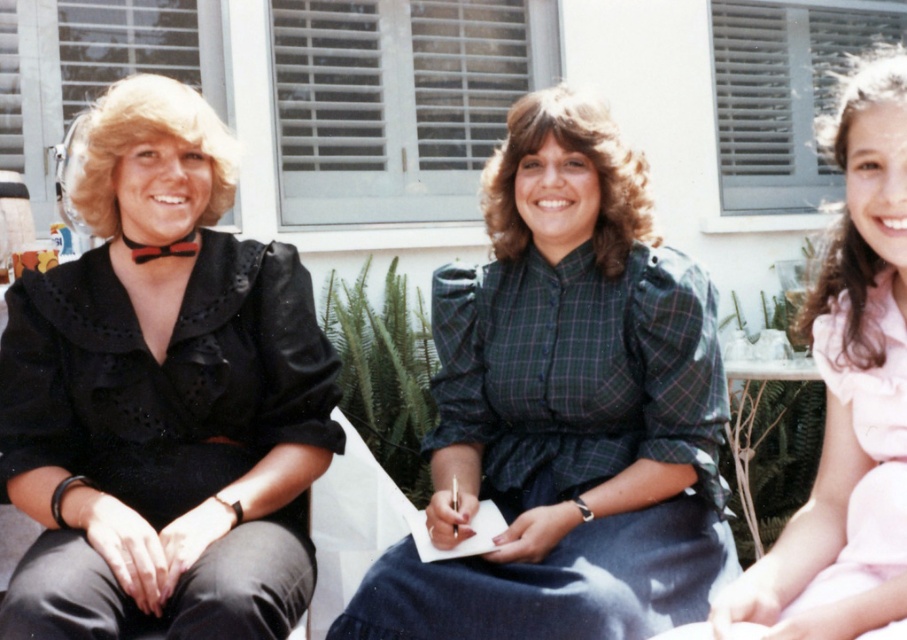
Is green plaid dress at center bigger than pink satin dress at right?

Correct, green plaid dress at center is larger in size than pink satin dress at right.

Between point (574, 310) and point (800, 328), which one is positioned in front?

Point (800, 328) is more forward.

The height and width of the screenshot is (640, 907). What are the coordinates of `green plaid dress at center` in the screenshot? It's located at (564, 408).

Image resolution: width=907 pixels, height=640 pixels. In order to click on black satin blouse at left in this screenshot , I will do `click(163, 396)`.

Who is higher up, black satin blouse at left or pink satin dress at right?

black satin blouse at left is above.

I want to click on black satin blouse at left, so click(163, 396).

The height and width of the screenshot is (640, 907). What do you see at coordinates (163, 396) in the screenshot?
I see `black satin blouse at left` at bounding box center [163, 396].

Is black satin blouse at left to the left of green plaid dress at center from the viewer's perspective?

Indeed, black satin blouse at left is positioned on the left side of green plaid dress at center.

Which is behind, point (168, 512) or point (508, 584)?

Point (168, 512)

The height and width of the screenshot is (640, 907). In order to click on black satin blouse at left in this screenshot , I will do `click(163, 396)`.